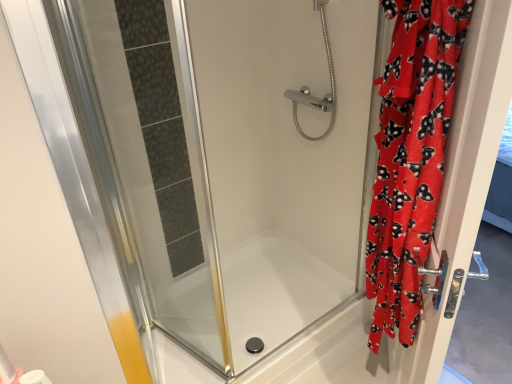
What do you see at coordinates (410, 156) in the screenshot?
I see `red velvet curtain at right` at bounding box center [410, 156].

Describe the element at coordinates (148, 161) in the screenshot. This screenshot has height=384, width=512. I see `transparent glass shower door at left, which ranks as the 1th screen door in left-to-right order` at that location.

Find the location of `transparent glass shower door at left, the second screen door from the right`. transparent glass shower door at left, the second screen door from the right is located at coordinates (148, 161).

Locate an element on the screen. Image resolution: width=512 pixels, height=384 pixels. transparent glass bathtub at center is located at coordinates (276, 292).

Is there a large distance between red velvet curtain at right and chrome metallic showerhead at upper center?

red velvet curtain at right is near chrome metallic showerhead at upper center, not far away.

Is red velvet curtain at right facing towards chrome metallic showerhead at upper center?

No, red velvet curtain at right is not facing towards chrome metallic showerhead at upper center.

From a real-world perspective, which object stands above the other?

chrome metallic showerhead at upper center, from a real-world perspective.

Is red velvet curtain at right positioned with its back to velvet red robe at right, which appears as the first screen door when viewed from the right?

Correct, red velvet curtain at right is looking away from velvet red robe at right, which appears as the first screen door when viewed from the right.

In the scene shown: Is red velvet curtain at right taller than velvet red robe at right, which appears as the first screen door when viewed from the right?

No.

Considering the relative sizes of chrome metallic showerhead at upper center and red velvet curtain at right in the image provided, is chrome metallic showerhead at upper center thinner than red velvet curtain at right?

In fact, chrome metallic showerhead at upper center might be wider than red velvet curtain at right.

Is chrome metallic showerhead at upper center not near red velvet curtain at right?

No, there isn't a large distance between chrome metallic showerhead at upper center and red velvet curtain at right.

Considering the sizes of objects chrome metallic showerhead at upper center and red velvet curtain at right in the image provided, who is taller, chrome metallic showerhead at upper center or red velvet curtain at right?

red velvet curtain at right.

Measure the distance between chrome metallic showerhead at upper center and red velvet curtain at right.

A distance of 30.84 inches exists between chrome metallic showerhead at upper center and red velvet curtain at right.

From the image's perspective, which one is positioned higher, transparent glass bathtub at center or transparent glass shower door at left, which ranks as the 1th screen door in left-to-right order?

From the image's view, transparent glass shower door at left, which ranks as the 1th screen door in left-to-right order, is above.

Would you say transparent glass bathtub at center is outside transparent glass shower door at left, the second screen door from the right?

transparent glass bathtub at center is positioned outside transparent glass shower door at left, the second screen door from the right.

From a real-world perspective, is transparent glass bathtub at center above or below transparent glass shower door at left, which ranks as the 1th screen door in left-to-right order?

From a real-world perspective, transparent glass bathtub at center is physically below transparent glass shower door at left, which ranks as the 1th screen door in left-to-right order.

Locate an element on the screen. curtain on the right of white matte toilet paper at lower left is located at coordinates (410, 156).

Which object is further away from the camera taking this photo, red velvet curtain at right or white matte toilet paper at lower left?

Positioned behind is white matte toilet paper at lower left.

Is red velvet curtain at right located outside white matte toilet paper at lower left?

Yes.

Is red velvet curtain at right thinner than white matte toilet paper at lower left?

In fact, red velvet curtain at right might be wider than white matte toilet paper at lower left.

Is point (418, 168) more distant than point (186, 45)?

That is True.

Considering the relative sizes of red velvet curtain at right and transparent glass shower door at left, which ranks as the 1th screen door in left-to-right order, in the image provided, is red velvet curtain at right thinner than transparent glass shower door at left, which ranks as the 1th screen door in left-to-right order,?

Yes, red velvet curtain at right is thinner than transparent glass shower door at left, which ranks as the 1th screen door in left-to-right order.

Does red velvet curtain at right have a lesser height compared to transparent glass shower door at left, which ranks as the 1th screen door in left-to-right order?

Yes, red velvet curtain at right is shorter than transparent glass shower door at left, which ranks as the 1th screen door in left-to-right order.

I want to click on screen door that appears behind the red velvet curtain at right, so click(x=148, y=161).

From the image's perspective, which is below, velvet red robe at right, which is the second screen door in left-to-right order, or chrome metallic showerhead at upper center?

From the image's view, velvet red robe at right, which is the second screen door in left-to-right order, is below.

Locate an element on the screen. The height and width of the screenshot is (384, 512). screen door located on the right of chrome metallic showerhead at upper center is located at coordinates (463, 180).

Considering the positions of points (439, 311) and (329, 65), is point (439, 311) farther from camera compared to point (329, 65)?

That is False.

Where is `shower that is on the left side of red velvet curtain at right`? Image resolution: width=512 pixels, height=384 pixels. shower that is on the left side of red velvet curtain at right is located at coordinates (308, 88).

Where is `screen door that is in front of the red velvet curtain at right`? screen door that is in front of the red velvet curtain at right is located at coordinates point(463,180).

When comparing their distances from transparent glass bathtub at center, does transparent glass shower door at left, which ranks as the 1th screen door in left-to-right order, or red velvet curtain at right seem closer?

transparent glass shower door at left, which ranks as the 1th screen door in left-to-right order, is closer to transparent glass bathtub at center.

Considering their positions, is white matte toilet paper at lower left positioned further to chrome metallic showerhead at upper center than transparent glass shower door at left, which ranks as the 1th screen door in left-to-right order?

white matte toilet paper at lower left is positioned further to the anchor chrome metallic showerhead at upper center.

Estimate the real-world distances between objects in this image. Which object is closer to red velvet curtain at right, chrome metallic showerhead at upper center or velvet red robe at right, which appears as the first screen door when viewed from the right?

velvet red robe at right, which appears as the first screen door when viewed from the right.

Estimate the real-world distances between objects in this image. Which object is closer to transparent glass shower door at left, which ranks as the 1th screen door in left-to-right order, red velvet curtain at right or transparent glass bathtub at center?

transparent glass bathtub at center is closer to transparent glass shower door at left, which ranks as the 1th screen door in left-to-right order.

From the image, which object appears to be nearer to red velvet curtain at right, transparent glass bathtub at center or velvet red robe at right, which appears as the first screen door when viewed from the right?

The object closer to red velvet curtain at right is velvet red robe at right, which appears as the first screen door when viewed from the right.

Considering their positions, is velvet red robe at right, which appears as the first screen door when viewed from the right, positioned closer to chrome metallic showerhead at upper center than red velvet curtain at right?

red velvet curtain at right is closer to chrome metallic showerhead at upper center.

Considering their positions, is transparent glass shower door at left, the second screen door from the right, positioned closer to red velvet curtain at right than velvet red robe at right, which appears as the first screen door when viewed from the right?

velvet red robe at right, which appears as the first screen door when viewed from the right, is closer to red velvet curtain at right.

Considering their positions, is velvet red robe at right, which is the second screen door in left-to-right order, positioned closer to red velvet curtain at right than chrome metallic showerhead at upper center?

Among the two, velvet red robe at right, which is the second screen door in left-to-right order, is located nearer to red velvet curtain at right.

Where is `curtain between chrome metallic showerhead at upper center and white matte toilet paper at lower left in the up-down direction`? The height and width of the screenshot is (384, 512). curtain between chrome metallic showerhead at upper center and white matte toilet paper at lower left in the up-down direction is located at coordinates (410, 156).

You are a GUI agent. You are given a task and a screenshot of the screen. Output one action in this format:
    pyautogui.click(x=<x>, y=<y>)
    Task: Click on the curtain positioned between velvet red robe at right, which is the second screen door in left-to-right order, and chrome metallic showerhead at upper center from near to far
    Image resolution: width=512 pixels, height=384 pixels.
    Given the screenshot: What is the action you would take?
    pyautogui.click(x=410, y=156)

Where is `shower between transparent glass shower door at left, which ranks as the 1th screen door in left-to-right order, and velvet red robe at right, which appears as the first screen door when viewed from the right`? This screenshot has width=512, height=384. shower between transparent glass shower door at left, which ranks as the 1th screen door in left-to-right order, and velvet red robe at right, which appears as the first screen door when viewed from the right is located at coordinates (308, 88).

Identify the location of screen door positioned between red velvet curtain at right and transparent glass bathtub at center from near to far. The width and height of the screenshot is (512, 384). (148, 161).